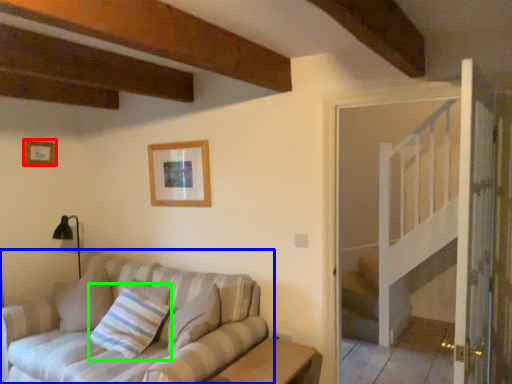
Question: Which is nearer to the picture frame (highlighted by a red box)? studio couch (highlighted by a blue box) or pillow (highlighted by a green box).

Choices:
 (A) studio couch
 (B) pillow

Answer: (B)